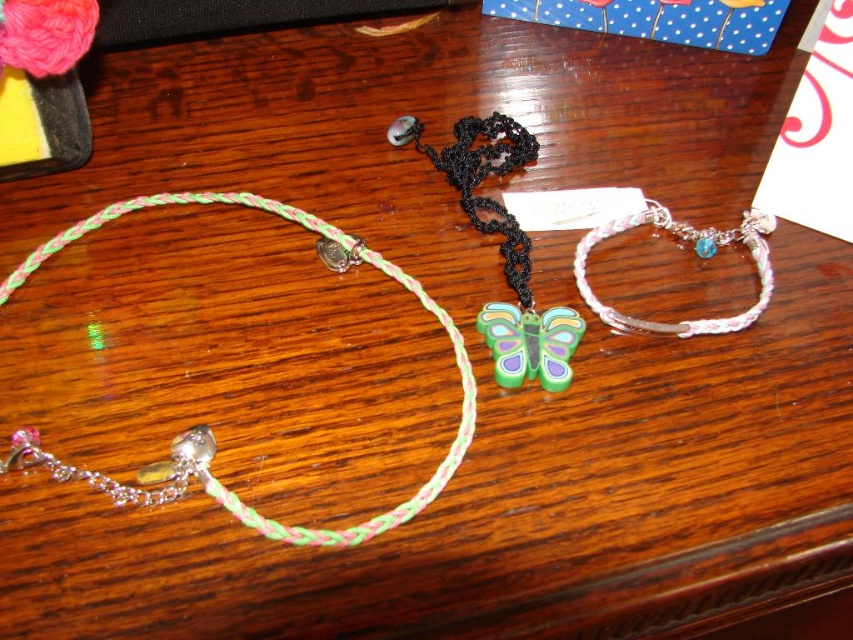
Does multicolored braided necklace at left appear under white braided bracelet at center?

Correct, multicolored braided necklace at left is located below white braided bracelet at center.

Locate an element on the screen. multicolored braided necklace at left is located at coordinates (210, 429).